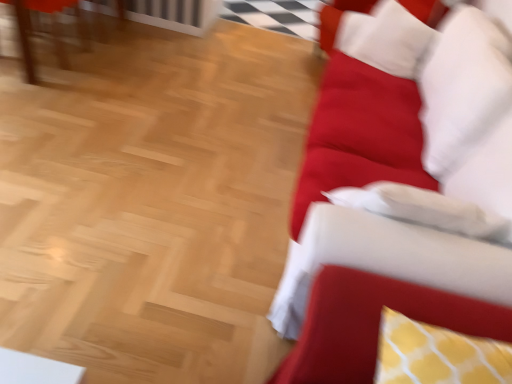
Question: Does white soft pillow at upper right turn towards matte wooden table at upper left?

Choices:
 (A) yes
 (B) no

Answer: (B)

Question: Is white soft pillow at upper right thinner than matte wooden table at upper left?

Choices:
 (A) yes
 (B) no

Answer: (A)

Question: Considering the relative sizes of white soft pillow at upper right and matte wooden table at upper left in the image provided, is white soft pillow at upper right taller than matte wooden table at upper left?

Choices:
 (A) no
 (B) yes

Answer: (B)

Question: Is white soft pillow at upper right directly adjacent to matte wooden table at upper left?

Choices:
 (A) yes
 (B) no

Answer: (B)

Question: Is white soft pillow at upper right smaller than matte wooden table at upper left?

Choices:
 (A) no
 (B) yes

Answer: (B)

Question: Is white soft pillow at upper right at the left side of matte wooden table at upper left?

Choices:
 (A) yes
 (B) no

Answer: (B)

Question: Is velvet red couch at right outside of yellow dotted cushion at right?

Choices:
 (A) no
 (B) yes

Answer: (B)

Question: Is the position of velvet red couch at right less distant than that of yellow dotted cushion at right?

Choices:
 (A) no
 (B) yes

Answer: (A)

Question: Does velvet red couch at right have a greater width compared to yellow dotted cushion at right?

Choices:
 (A) no
 (B) yes

Answer: (B)

Question: From the image's perspective, does velvet red couch at right appear higher than yellow dotted cushion at right?

Choices:
 (A) yes
 (B) no

Answer: (A)

Question: Can you confirm if velvet red couch at right is positioned to the left of yellow dotted cushion at right?

Choices:
 (A) no
 (B) yes

Answer: (A)

Question: From the image's perspective, does velvet red couch at right appear lower than yellow dotted cushion at right?

Choices:
 (A) yes
 (B) no

Answer: (B)

Question: Are matte wooden table at upper left and velvet red couch at right making contact?

Choices:
 (A) no
 (B) yes

Answer: (A)